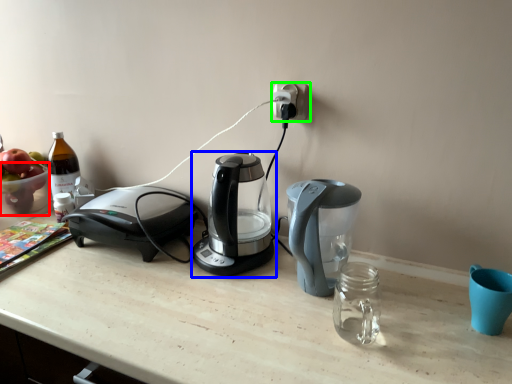
Question: Estimate the real-world distances between objects in this image. Which object is closer to bowl (highlighted by a red box), coffee maker (highlighted by a blue box) or power plugs and sockets (highlighted by a green box)?

Choices:
 (A) coffee maker
 (B) power plugs and sockets

Answer: (A)